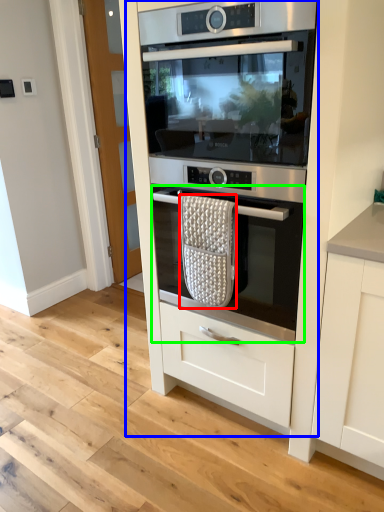
Question: Based on their relative distances, which object is farther from material (highlighted by a red box)? Choose from oven (highlighted by a blue box) and oven (highlighted by a green box).

Choices:
 (A) oven
 (B) oven

Answer: (A)